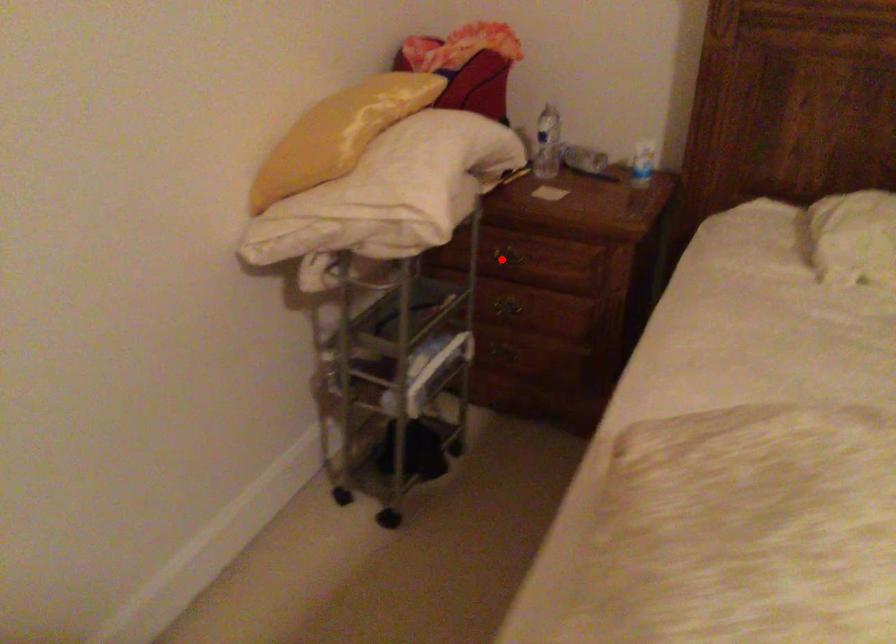
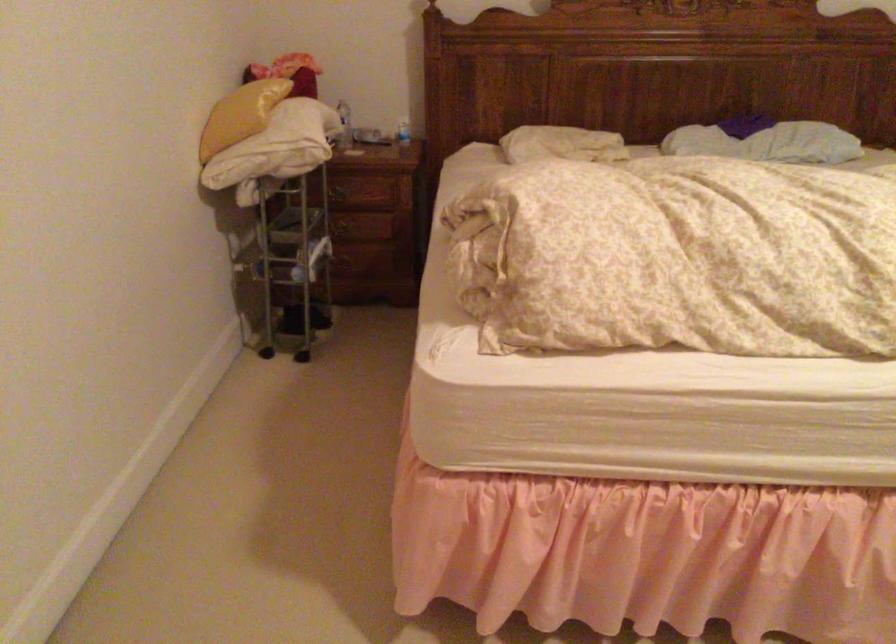
In the second image, find the point that corresponds to the highlighted location in the first image.

(338, 194)